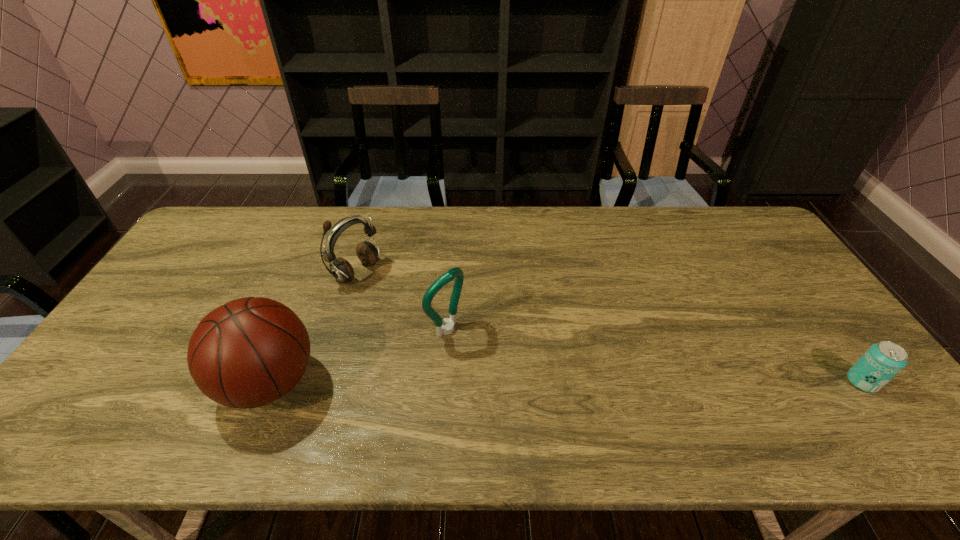
This screenshot has width=960, height=540. Identify the location of vacant spot on the desktop that is between the basketball and the rightmost object and is positioned at the jaws of the third object from left to right. (524, 382).

This screenshot has height=540, width=960. Identify the location of vacant space on the desktop that is between the basketball and the beer can and is positioned on the ear pads of the earphone. (532, 382).